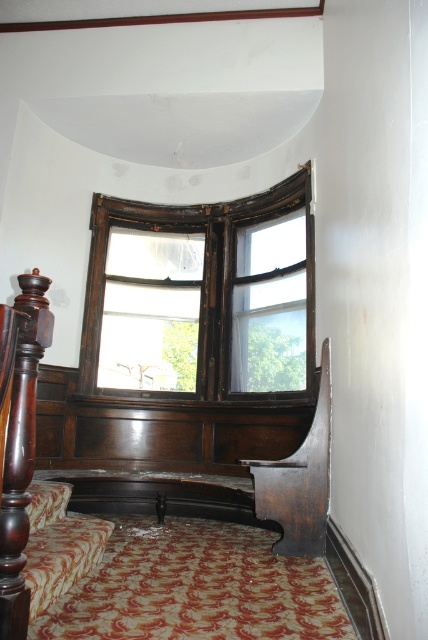
Question: Which object is the closest to the dark wood bed at center?

Choices:
 (A) wooden frame window at upper center
 (B) dark wood/rustic stair rail at lower left

Answer: (A)

Question: Is wooden frame window at upper center above dark wood bed at center?

Choices:
 (A) no
 (B) yes

Answer: (B)

Question: Which object is positioned farthest from the wooden frame window at upper center?

Choices:
 (A) dark wood/rustic stair rail at lower left
 (B) dark wood bed at center

Answer: (A)

Question: Which is farther from the dark wood bed at center?

Choices:
 (A) dark wood/rustic stair rail at lower left
 (B) wooden frame window at upper center

Answer: (A)

Question: Can you confirm if wooden frame window at upper center is bigger than dark wood bed at center?

Choices:
 (A) no
 (B) yes

Answer: (B)

Question: Considering the relative positions of dark wood bed at center and dark wood/rustic stair rail at lower left in the image provided, where is dark wood bed at center located with respect to dark wood/rustic stair rail at lower left?

Choices:
 (A) right
 (B) left

Answer: (A)